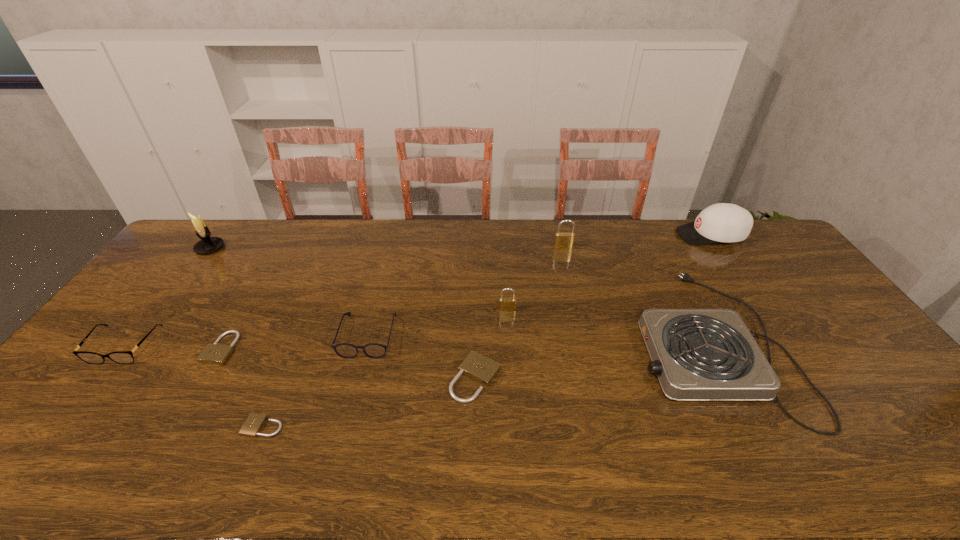
Locate an element on the screen. The height and width of the screenshot is (540, 960). the rightmost beige padlock is located at coordinates (476, 366).

You are a GUI agent. You are given a task and a screenshot of the screen. Output one action in this format:
    pyautogui.click(x=<x>, y=<y>)
    Task: Click on the third padlock from right to left
    This screenshot has height=540, width=960.
    Given the screenshot: What is the action you would take?
    pyautogui.click(x=476, y=366)

Locate an element on the screen. This screenshot has height=540, width=960. the leftmost padlock is located at coordinates (217, 354).

Where is `the leftmost beige padlock`? the leftmost beige padlock is located at coordinates (217, 354).

I want to click on the fourth object from left to right, so click(x=252, y=426).

In order to click on the nearest beige padlock in this screenshot , I will do `click(252, 426)`.

Image resolution: width=960 pixels, height=540 pixels. In order to click on vacant position located on the right of the white candle holder in this screenshot , I will do `click(281, 248)`.

Locate an element on the screen. Image resolution: width=960 pixels, height=540 pixels. free space located on the front-facing side of the white baseball cap is located at coordinates (645, 235).

I want to click on free space located on the front-facing side of the white baseball cap, so click(606, 235).

Identify the location of vacant space located 0.300m on the front-facing side of the white baseball cap. Image resolution: width=960 pixels, height=540 pixels. (598, 235).